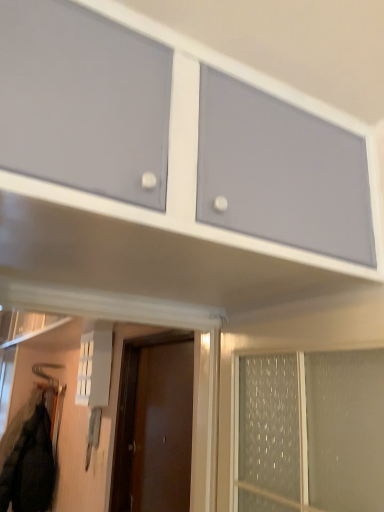
Question: Does black matte jacket at lower left contain matte gray cabinet at upper center?

Choices:
 (A) yes
 (B) no

Answer: (B)

Question: Would you consider black matte jacket at lower left to be distant from matte gray cabinet at upper center?

Choices:
 (A) no
 (B) yes

Answer: (B)

Question: Is the position of black matte jacket at lower left more distant than that of matte gray cabinet at upper center?

Choices:
 (A) no
 (B) yes

Answer: (B)

Question: Can you confirm if black matte jacket at lower left is bigger than matte gray cabinet at upper center?

Choices:
 (A) yes
 (B) no

Answer: (B)

Question: From the image's perspective, is black matte jacket at lower left under matte gray cabinet at upper center?

Choices:
 (A) no
 (B) yes

Answer: (B)

Question: Is black matte jacket at lower left at the right side of matte gray cabinet at upper center?

Choices:
 (A) no
 (B) yes

Answer: (A)

Question: Considering the relative sizes of brown matte door at center and matte gray cabinet at upper center in the image provided, is brown matte door at center bigger than matte gray cabinet at upper center?

Choices:
 (A) yes
 (B) no

Answer: (B)

Question: Is brown matte door at center at the right side of matte gray cabinet at upper center?

Choices:
 (A) no
 (B) yes

Answer: (A)

Question: From the image's perspective, is brown matte door at center above matte gray cabinet at upper center?

Choices:
 (A) yes
 (B) no

Answer: (B)

Question: Can you confirm if brown matte door at center is positioned to the left of matte gray cabinet at upper center?

Choices:
 (A) no
 (B) yes

Answer: (B)

Question: Would you say brown matte door at center contains matte gray cabinet at upper center?

Choices:
 (A) no
 (B) yes

Answer: (A)

Question: Can you confirm if brown matte door at center is smaller than matte gray cabinet at upper center?

Choices:
 (A) no
 (B) yes

Answer: (B)

Question: Is matte gray cabinet at upper center directly adjacent to black matte jacket at lower left?

Choices:
 (A) no
 (B) yes

Answer: (A)